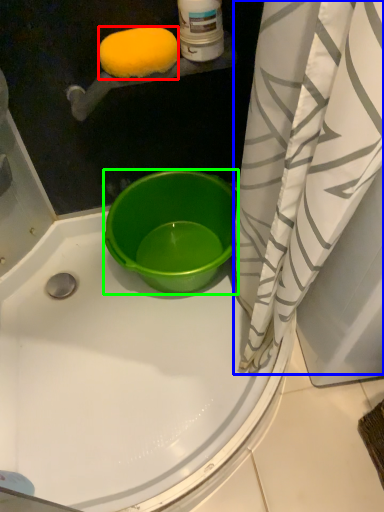
Question: Considering the real-world distances, which object is closest to lemon (highlighted by a red box)? curtain (highlighted by a blue box) or bucket (highlighted by a green box).

Choices:
 (A) curtain
 (B) bucket

Answer: (A)